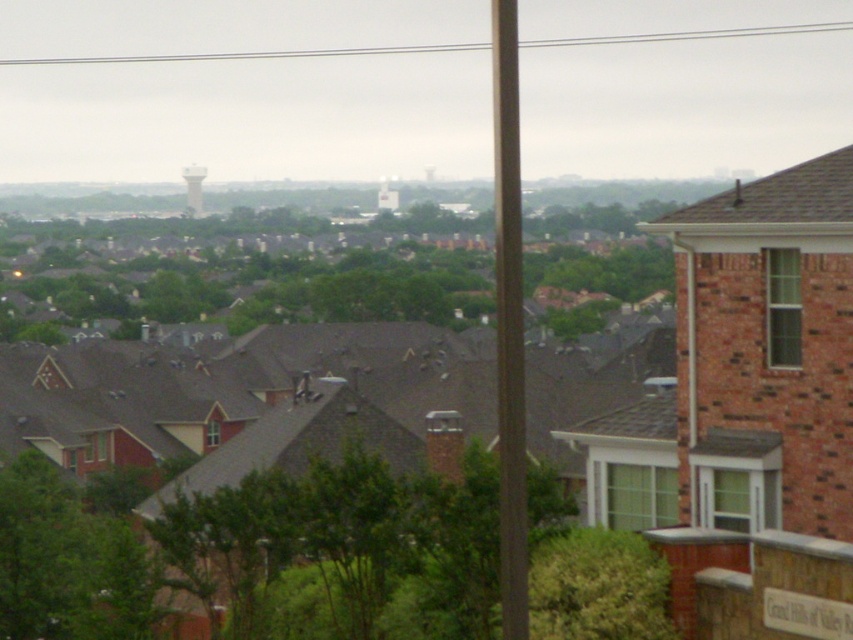
You are standing in the suburban neighborhood scene and want to walk from point A to point B. Point A is at coordinates point (505, 74) and point B is at coordinates point (386, 184). According to the image, which point is closer to you?

Point (505, 74) is in front of point (386, 184), so point A is closer to you.

You are a delivery drone flying over the suburban neighborhood. You need to deliver a package to the brown wood pole at center. However, there is a white concrete water tower at center in the way. Can you safely navigate around the water tower to reach the pole?

The brown wood pole at center is positioned under the white concrete water tower at center, so the drone cannot safely navigate around the water tower to reach the pole because the pole is directly beneath it.